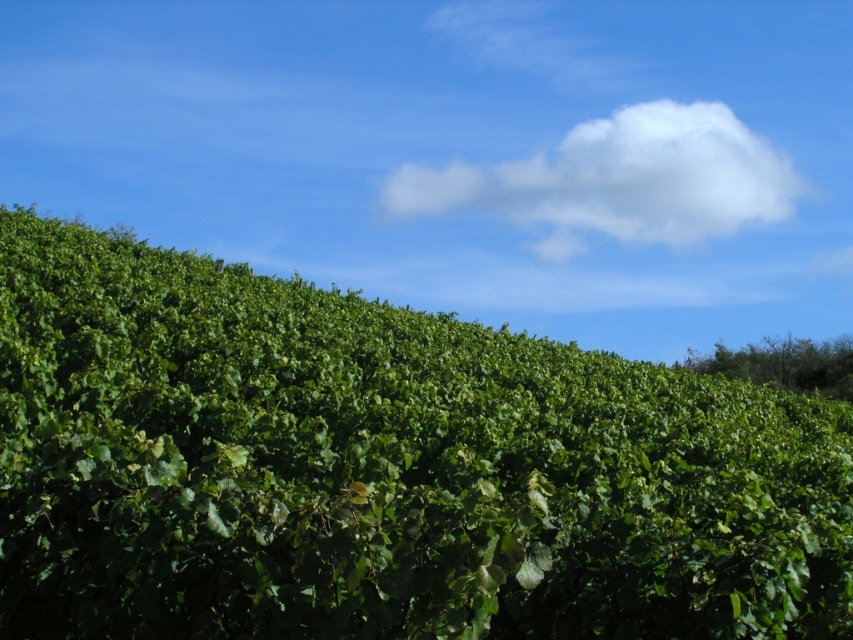
Question: Which point is closer to the camera taking this photo?

Choices:
 (A) (167, 468)
 (B) (691, 186)

Answer: (A)

Question: Does green leafy hedge at center lie behind white fluffy cloud at upper center?

Choices:
 (A) yes
 (B) no

Answer: (B)

Question: Is green leafy hedge at center positioned in front of white fluffy cloud at upper center?

Choices:
 (A) yes
 (B) no

Answer: (A)

Question: Which point is farther to the camera?

Choices:
 (A) (445, 500)
 (B) (595, 228)

Answer: (B)

Question: Is green leafy hedge at center positioned before white fluffy cloud at upper center?

Choices:
 (A) yes
 (B) no

Answer: (A)